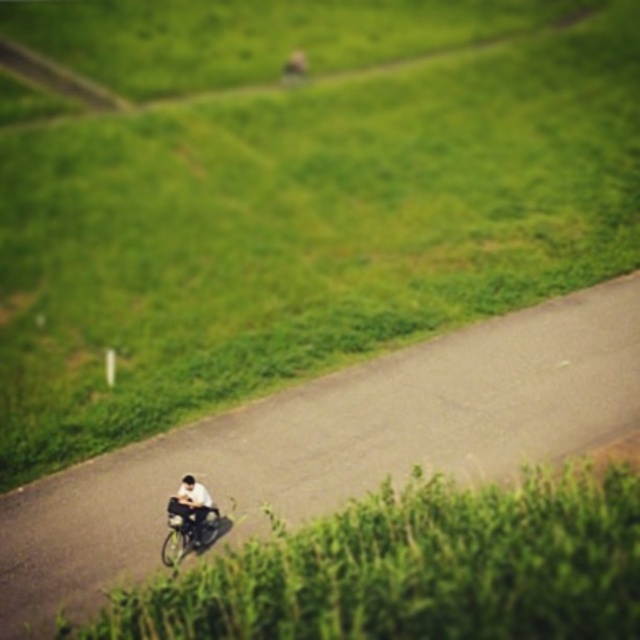
Does asphalt road at center have a lesser width compared to white fabric shirt at center?

No, asphalt road at center is not thinner than white fabric shirt at center.

Between asphalt road at center and white fabric shirt at center, which one appears on the left side from the viewer's perspective?

white fabric shirt at center

Who is more forward, (518, 422) or (195, 512)?

Point (195, 512) is in front.

The height and width of the screenshot is (640, 640). I want to click on asphalt road at center, so click(333, 444).

Is point (275, 493) farther from camera compared to point (173, 540)?

That is True.

I want to click on asphalt road at center, so click(333, 444).

How much distance is there between metallic silver bicycle at center and white fabric shirt at center?

A distance of 4.44 inches exists between metallic silver bicycle at center and white fabric shirt at center.

Between metallic silver bicycle at center and white fabric shirt at center, which one has more height?

Standing taller between the two is white fabric shirt at center.

Between point (202, 538) and point (188, 504), which one is positioned behind?

The point (202, 538) is more distant.

Locate an element on the screen. metallic silver bicycle at center is located at coordinates (188, 529).